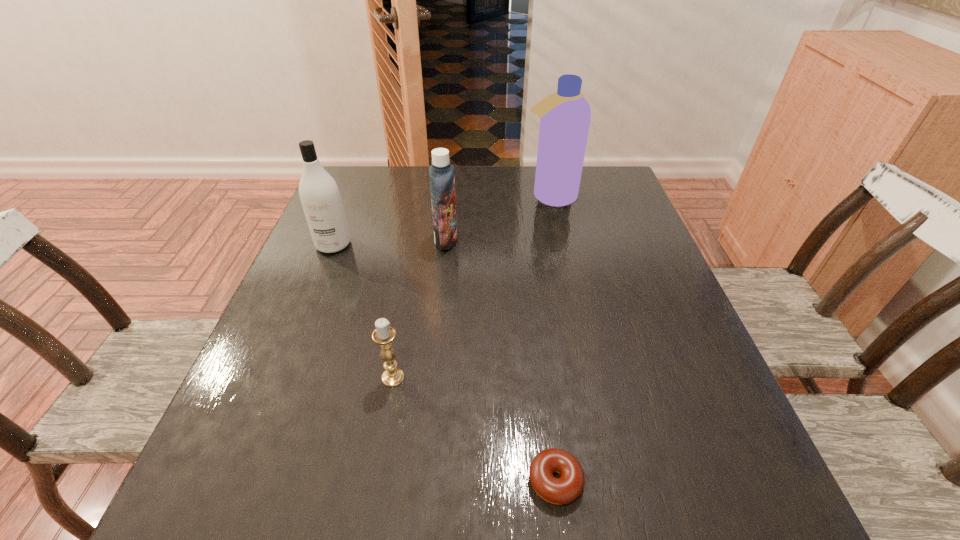
This screenshot has height=540, width=960. Identify the location of the tallest shampoo. (565, 116).

Find the location of a particular element. the tallest object is located at coordinates (565, 116).

I want to click on the leftmost object, so click(319, 194).

Where is `the third object from left to right`? Image resolution: width=960 pixels, height=540 pixels. the third object from left to right is located at coordinates (441, 173).

The height and width of the screenshot is (540, 960). Identify the location of the second object from left to right. (384, 334).

The height and width of the screenshot is (540, 960). I want to click on the second nearest object, so click(x=384, y=334).

At what (x,y) coordinates should I click in order to perform the action: click on the nearest object. Please return your answer as a coordinate pair (x, y). The image size is (960, 540). Looking at the image, I should click on (563, 490).

Locate an element on the screen. This screenshot has height=540, width=960. doughnut is located at coordinates (563, 490).

Locate an element on the screen. The width and height of the screenshot is (960, 540). free space located on the left of the farthest shampoo is located at coordinates (400, 197).

The width and height of the screenshot is (960, 540). Find the location of `vacant space situated 0.050m on the front-facing side of the leftmost object`. vacant space situated 0.050m on the front-facing side of the leftmost object is located at coordinates (324, 269).